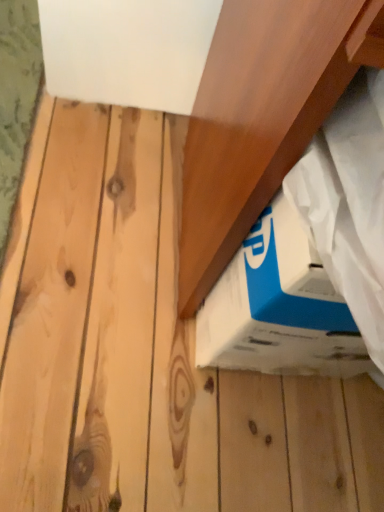
Question: Should I look upward or downward to see blue cardboard box at lower right?

Choices:
 (A) up
 (B) down

Answer: (B)

Question: Is blue cardboard box at lower right positioned before wooden at upper right?

Choices:
 (A) yes
 (B) no

Answer: (B)

Question: Considering the relative positions of blue cardboard box at lower right and wooden at upper right in the image provided, is blue cardboard box at lower right to the left of wooden at upper right from the viewer's perspective?

Choices:
 (A) no
 (B) yes

Answer: (B)

Question: Is blue cardboard box at lower right outside wooden at upper right?

Choices:
 (A) yes
 (B) no

Answer: (B)

Question: Is blue cardboard box at lower right taller than wooden at upper right?

Choices:
 (A) yes
 (B) no

Answer: (B)

Question: Is blue cardboard box at lower right bigger than wooden at upper right?

Choices:
 (A) yes
 (B) no

Answer: (B)

Question: From a real-world perspective, does blue cardboard box at lower right sit lower than wooden at upper right?

Choices:
 (A) yes
 (B) no

Answer: (A)

Question: Would you say blue cardboard box at lower right is part of wooden at upper right's contents?

Choices:
 (A) yes
 (B) no

Answer: (A)

Question: Can you confirm if wooden at upper right is positioned to the right of blue cardboard box at lower right?

Choices:
 (A) yes
 (B) no

Answer: (A)

Question: Can you confirm if wooden at upper right is thinner than blue cardboard box at lower right?

Choices:
 (A) no
 (B) yes

Answer: (A)

Question: Is wooden at upper right positioned far away from blue cardboard box at lower right?

Choices:
 (A) no
 (B) yes

Answer: (A)

Question: Is wooden at upper right bigger than blue cardboard box at lower right?

Choices:
 (A) yes
 (B) no

Answer: (A)

Question: Are wooden at upper right and blue cardboard box at lower right beside each other?

Choices:
 (A) no
 (B) yes

Answer: (A)

Question: From their relative heights in the image, would you say blue cardboard box at lower right is taller or shorter than wooden at upper right?

Choices:
 (A) tall
 (B) short

Answer: (B)